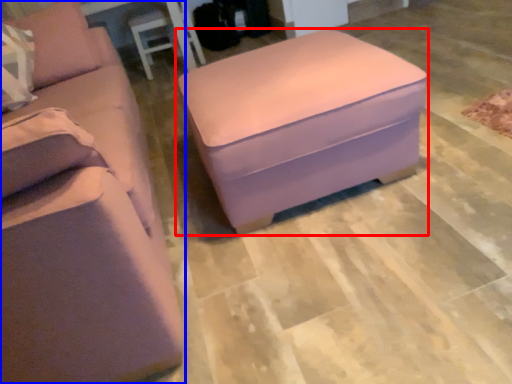
Question: Among these objects, which one is nearest to the camera, table (highlighted by a red box) or studio couch (highlighted by a blue box)?

Choices:
 (A) table
 (B) studio couch

Answer: (B)